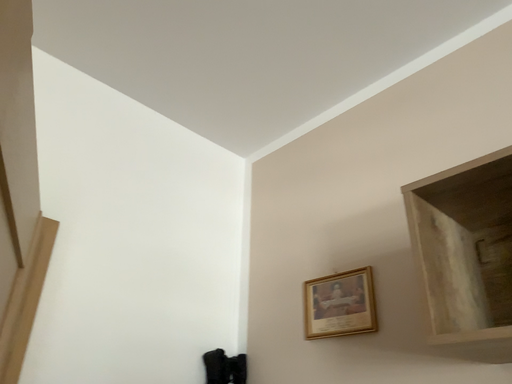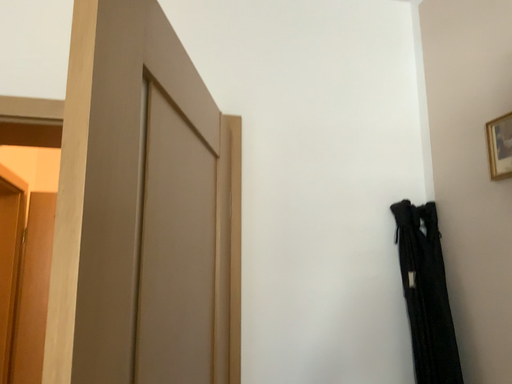
Question: How did the camera likely rotate when shooting the video?

Choices:
 (A) rotated upward
 (B) rotated downward

Answer: (B)